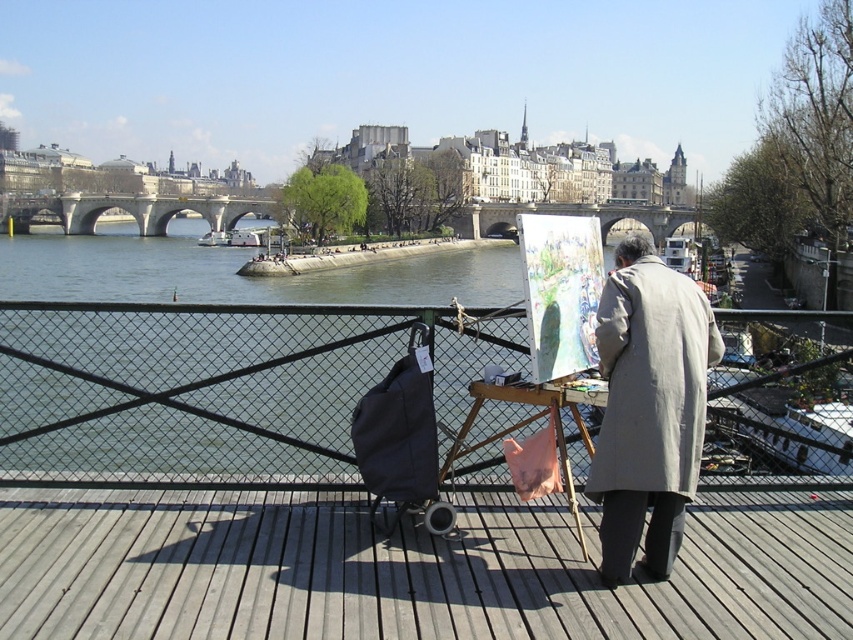
Question: Estimate the real-world distances between objects in this image. Which object is closer to the gray matte coat at right?

Choices:
 (A) wooden easel at center
 (B) metal fence at center

Answer: (A)

Question: Which object is positioned closest to the metal fence at center?

Choices:
 (A) wooden easel at center
 (B) gray matte coat at right

Answer: (A)

Question: Which object is positioned closest to the wooden easel at center?

Choices:
 (A) metal fence at center
 (B) gray matte coat at right

Answer: (B)

Question: Does gray matte coat at right have a lesser width compared to wooden easel at center?

Choices:
 (A) yes
 (B) no

Answer: (A)

Question: In this image, where is metal fence at center located relative to wooden easel at center?

Choices:
 (A) left
 (B) right

Answer: (B)

Question: Can you confirm if metal fence at center is positioned to the right of wooden easel at center?

Choices:
 (A) no
 (B) yes

Answer: (B)